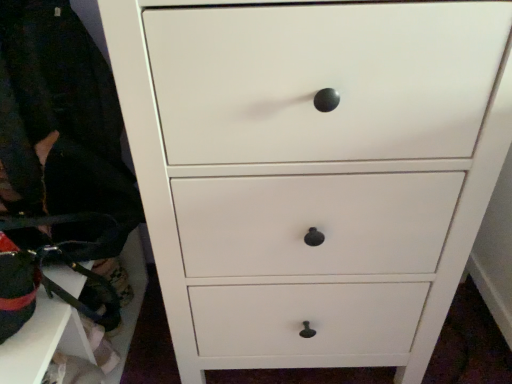
Question: From a real-world perspective, relative to black fabric at left, is white matte cabinet at lower left vertically above or below?

Choices:
 (A) above
 (B) below

Answer: (B)

Question: From the image's perspective, is white matte cabinet at lower left located above or below black fabric at left?

Choices:
 (A) above
 (B) below

Answer: (B)

Question: Relative to black fabric at left, is white matte cabinet at lower left in front or behind?

Choices:
 (A) front
 (B) behind

Answer: (B)

Question: Based on their sizes in the image, would you say black fabric at left is bigger or smaller than white matte cabinet at lower left?

Choices:
 (A) big
 (B) small

Answer: (B)

Question: Considering the positions of point (56, 14) and point (54, 347), is point (56, 14) closer or farther from the camera than point (54, 347)?

Choices:
 (A) closer
 (B) farther

Answer: (B)

Question: Is black fabric at left in front of or behind white matte cabinet at lower left in the image?

Choices:
 (A) behind
 (B) front

Answer: (B)

Question: Which is correct: black fabric at left is inside white matte cabinet at lower left, or outside of it?

Choices:
 (A) inside
 (B) outside

Answer: (B)